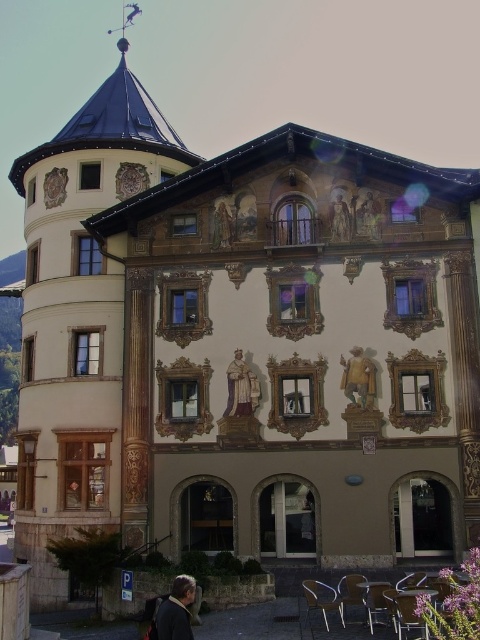
You are a delivery person who needs to place a large package that is 1.2 meters in height. You see the dark brown leather jacket at lower left and the gold ornate statue at center. Which object can the package fit next to without exceeding its height?

The dark brown leather jacket at lower left has a larger size compared to the gold ornate statue at center, so the package can be placed next to the dark brown leather jacket at lower left since it is taller than the statue.

You are a visitor standing at the entrance of the building and see the dark brown leather jacket at lower left and the gold ornate statue at center. Which object is closer to the ground?

The dark brown leather jacket at lower left is closer to the ground because it is located below the gold ornate statue at center.

You are standing in front of the building and notice two points marked on the tower. The first point is at coordinate point (365, 216) and the second is at point (332, 216). Which point is closer to your current position?

Point (365, 216) is closer to the camera than point (332, 216), so the first point is closer to your current position.